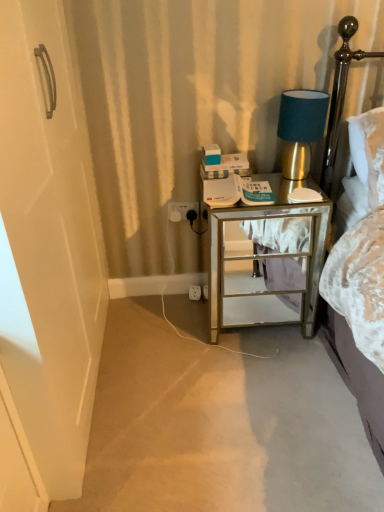
Describe the element at coordinates (195, 292) in the screenshot. The image size is (384, 512). I see `white plastic electric outlet at lower center, marked as the 2th electric outlet in a top-to-bottom arrangement` at that location.

This screenshot has height=512, width=384. What do you see at coordinates (340, 96) in the screenshot?
I see `metallic gold headboard at upper right` at bounding box center [340, 96].

What is the approximate height of gold metallic table lamp at upper right?

gold metallic table lamp at upper right is 13.17 inches tall.

Find the location of a particular element. This screenshot has width=384, height=512. white plastic electric outlet at lower center, positioned as the 1th electric outlet in front-to-back order is located at coordinates pos(182,211).

Considering the relative positions of white plastic electric outlet at lower center, the 1th electric outlet when ordered from top to bottom, and metallic gold headboard at upper right in the image provided, is white plastic electric outlet at lower center, the 1th electric outlet when ordered from top to bottom, in front of metallic gold headboard at upper right?

No.

Can you tell me how much white plastic electric outlet at lower center, positioned as the 2th electric outlet in bottom-to-top order, and metallic gold headboard at upper right differ in facing direction?

The angle between the facing direction of white plastic electric outlet at lower center, positioned as the 2th electric outlet in bottom-to-top order, and the facing direction of metallic gold headboard at upper right is 0.00727 degrees.

Would you consider white plastic electric outlet at lower center, the 1th electric outlet when ordered from top to bottom, to be distant from metallic gold headboard at upper right?

That's not correct — white plastic electric outlet at lower center, the 1th electric outlet when ordered from top to bottom, is a little close to metallic gold headboard at upper right.

In the scene shown: From a real-world perspective, is white plastic electric outlet at lower center, the second electric outlet viewed from the back, physically located above or below metallic gold headboard at upper right?

white plastic electric outlet at lower center, the second electric outlet viewed from the back, is below metallic gold headboard at upper right.

How different are the orientations of mirrored glass nightstand at right and white plastic electric outlet at lower center, arranged as the 2th electric outlet when viewed from the front, in degrees?

The facing directions of mirrored glass nightstand at right and white plastic electric outlet at lower center, arranged as the 2th electric outlet when viewed from the front, are 9.68 degrees apart.

Looking at this image, which is in front, mirrored glass nightstand at right or white plastic electric outlet at lower center, which is the 1th electric outlet in back-to-front order?

mirrored glass nightstand at right is in front.

Based on the photo, considering the sizes of mirrored glass nightstand at right and white plastic electric outlet at lower center, which is the 1th electric outlet in back-to-front order, in the image, is mirrored glass nightstand at right wider or thinner than white plastic electric outlet at lower center, which is the 1th electric outlet in back-to-front order,?

In the image, mirrored glass nightstand at right appears to be wider than white plastic electric outlet at lower center, which is the 1th electric outlet in back-to-front order.

The width and height of the screenshot is (384, 512). In order to click on electric outlet below the mirrored glass nightstand at right (from a real-world perspective) in this screenshot , I will do `click(195, 292)`.

Is point (290, 311) positioned after point (334, 114)?

Yes.

Is mirrored glass nightstand at right inside or outside of metallic gold headboard at upper right?

mirrored glass nightstand at right is not enclosed by metallic gold headboard at upper right.

Considering the sizes of objects mirrored glass nightstand at right and metallic gold headboard at upper right in the image provided, who is thinner, mirrored glass nightstand at right or metallic gold headboard at upper right?

With smaller width is metallic gold headboard at upper right.

What are the coordinates of `nightstand below the metallic gold headboard at upper right (from a real-world perspective)` in the screenshot? It's located at (254, 258).

Considering the positions of point (194, 288) and point (346, 64), is point (194, 288) closer or farther from the camera than point (346, 64)?

Point (194, 288) appears to be farther away from the viewer than point (346, 64).

From a real-world perspective, starting from the metallic gold headboard at upper right, which electric outlet is the 2nd one below it? Please provide its 2D coordinates.

[(195, 292)]

How many degrees apart are the facing directions of white plastic electric outlet at lower center, which is the 1th electric outlet in back-to-front order, and metallic gold headboard at upper right?

The angle between the facing direction of white plastic electric outlet at lower center, which is the 1th electric outlet in back-to-front order, and the facing direction of metallic gold headboard at upper right is 9.68 degrees.

Does white plastic electric outlet at lower center, marked as the 2th electric outlet in a top-to-bottom arrangement, have a lesser height compared to metallic gold headboard at upper right?

Indeed, white plastic electric outlet at lower center, marked as the 2th electric outlet in a top-to-bottom arrangement, has a lesser height compared to metallic gold headboard at upper right.

From the image's perspective, which is above, white plastic electric outlet at lower center, marked as the 2th electric outlet in a top-to-bottom arrangement, or gold metallic table lamp at upper right?

gold metallic table lamp at upper right appears higher in the image.

Between white plastic electric outlet at lower center, arranged as the 2th electric outlet when viewed from the front, and gold metallic table lamp at upper right, which one has larger size?

Bigger between the two is gold metallic table lamp at upper right.

From a real-world perspective, who is located lower, white plastic electric outlet at lower center, which is the 1th electric outlet in back-to-front order, or gold metallic table lamp at upper right?

white plastic electric outlet at lower center, which is the 1th electric outlet in back-to-front order.

Is white plastic electric outlet at lower center, which is counted as the 1th electric outlet, starting from the bottom, touching gold metallic table lamp at upper right?

white plastic electric outlet at lower center, which is counted as the 1th electric outlet, starting from the bottom, and gold metallic table lamp at upper right are not in contact.

Is metallic gold headboard at upper right to the left of white plastic electric outlet at lower center, positioned as the 2th electric outlet in bottom-to-top order, from the viewer's perspective?

In fact, metallic gold headboard at upper right is to the right of white plastic electric outlet at lower center, positioned as the 2th electric outlet in bottom-to-top order.

Does metallic gold headboard at upper right have a smaller size compared to white plastic electric outlet at lower center, positioned as the 2th electric outlet in bottom-to-top order?

No, metallic gold headboard at upper right is not smaller than white plastic electric outlet at lower center, positioned as the 2th electric outlet in bottom-to-top order.

Looking at their sizes, would you say metallic gold headboard at upper right is wider or thinner than white plastic electric outlet at lower center, the second electric outlet viewed from the back?

Clearly, metallic gold headboard at upper right has more width compared to white plastic electric outlet at lower center, the second electric outlet viewed from the back.

From a real-world perspective, is metallic gold headboard at upper right positioned over white plastic electric outlet at lower center, the 1th electric outlet when ordered from top to bottom, based on gravity?

Yes, from a real-world perspective, metallic gold headboard at upper right is on top of white plastic electric outlet at lower center, the 1th electric outlet when ordered from top to bottom.

Considering the relative positions of metallic gold headboard at upper right and white plastic electric outlet at lower center, which is counted as the 1th electric outlet, starting from the bottom, in the image provided, is metallic gold headboard at upper right to the left of white plastic electric outlet at lower center, which is counted as the 1th electric outlet, starting from the bottom, from the viewer's perspective?

Incorrect, metallic gold headboard at upper right is not on the left side of white plastic electric outlet at lower center, which is counted as the 1th electric outlet, starting from the bottom.

Which object is closer to the camera, metallic gold headboard at upper right or white plastic electric outlet at lower center, arranged as the 2th electric outlet when viewed from the front?

metallic gold headboard at upper right is in front.

I want to click on headboard that is above the white plastic electric outlet at lower center, marked as the 2th electric outlet in a top-to-bottom arrangement (from the image's perspective), so click(340, 96).

Who is bigger, metallic gold headboard at upper right or white plastic electric outlet at lower center, arranged as the 2th electric outlet when viewed from the front?

With larger size is metallic gold headboard at upper right.

This screenshot has height=512, width=384. In order to click on headboard above the white plastic electric outlet at lower center, the 1th electric outlet when ordered from top to bottom (from a real-world perspective) in this screenshot , I will do `click(340, 96)`.

Locate an element on the screen. The image size is (384, 512). nightstand that appears on the right of white plastic electric outlet at lower center, arranged as the 2th electric outlet when viewed from the front is located at coordinates (254, 258).

From the image, which object appears to be nearer to gold metallic table lamp at upper right, white plastic electric outlet at lower center, the second electric outlet viewed from the back, or mirrored glass nightstand at right?

Based on the image, mirrored glass nightstand at right appears to be nearer to gold metallic table lamp at upper right.

When comparing their distances from white plastic electric outlet at lower center, arranged as the 2th electric outlet when viewed from the front, does mirrored glass nightstand at right or gold metallic table lamp at upper right seem closer?

mirrored glass nightstand at right is closer to white plastic electric outlet at lower center, arranged as the 2th electric outlet when viewed from the front.

Based on their spatial positions, is white plastic electric outlet at lower center, arranged as the 2th electric outlet when viewed from the front, or white plastic electric outlet at lower center, positioned as the 1th electric outlet in front-to-back order, closer to metallic gold headboard at upper right?

Based on the image, white plastic electric outlet at lower center, positioned as the 1th electric outlet in front-to-back order, appears to be nearer to metallic gold headboard at upper right.

Considering their positions, is white plastic electric outlet at lower center, which is the 1th electric outlet in back-to-front order, positioned further to metallic gold headboard at upper right than mirrored glass nightstand at right?

white plastic electric outlet at lower center, which is the 1th electric outlet in back-to-front order, lies further to metallic gold headboard at upper right than the other object.

Estimate the real-world distances between objects in this image. Which object is further from white plastic electric outlet at lower center, arranged as the 2th electric outlet when viewed from the front, gold metallic table lamp at upper right or white plastic electric outlet at lower center, the second electric outlet viewed from the back?

gold metallic table lamp at upper right is further to white plastic electric outlet at lower center, arranged as the 2th electric outlet when viewed from the front.

Based on their spatial positions, is white plastic electric outlet at lower center, which is the 1th electric outlet in back-to-front order, or metallic gold headboard at upper right closer to white plastic electric outlet at lower center, positioned as the 2th electric outlet in bottom-to-top order?

white plastic electric outlet at lower center, which is the 1th electric outlet in back-to-front order, lies closer to white plastic electric outlet at lower center, positioned as the 2th electric outlet in bottom-to-top order, than the other object.

From the image, which object appears to be farther from gold metallic table lamp at upper right, white plastic electric outlet at lower center, arranged as the 2th electric outlet when viewed from the front, or white plastic electric outlet at lower center, the second electric outlet viewed from the back?

Among the two, white plastic electric outlet at lower center, arranged as the 2th electric outlet when viewed from the front, is located further to gold metallic table lamp at upper right.

When comparing their distances from gold metallic table lamp at upper right, does metallic gold headboard at upper right or mirrored glass nightstand at right seem further?

mirrored glass nightstand at right is positioned further to the anchor gold metallic table lamp at upper right.

The image size is (384, 512). Identify the location of electric outlet that lies between gold metallic table lamp at upper right and white plastic electric outlet at lower center, arranged as the 2th electric outlet when viewed from the front, from top to bottom. (182, 211).

This screenshot has height=512, width=384. Find the location of `headboard between gold metallic table lamp at upper right and white plastic electric outlet at lower center, which is the 1th electric outlet in back-to-front order, from top to bottom`. headboard between gold metallic table lamp at upper right and white plastic electric outlet at lower center, which is the 1th electric outlet in back-to-front order, from top to bottom is located at coordinates (340, 96).

Find the location of a particular element. This screenshot has width=384, height=512. table lamp between white plastic electric outlet at lower center, positioned as the 2th electric outlet in bottom-to-top order, and metallic gold headboard at upper right is located at coordinates (300, 128).

You are a GUI agent. You are given a task and a screenshot of the screen. Output one action in this format:
    pyautogui.click(x=<x>, y=<y>)
    Task: Click on the electric outlet between gold metallic table lamp at upper right and mirrored glass nightstand at right in the vertical direction
    This screenshot has height=512, width=384.
    Given the screenshot: What is the action you would take?
    pyautogui.click(x=182, y=211)